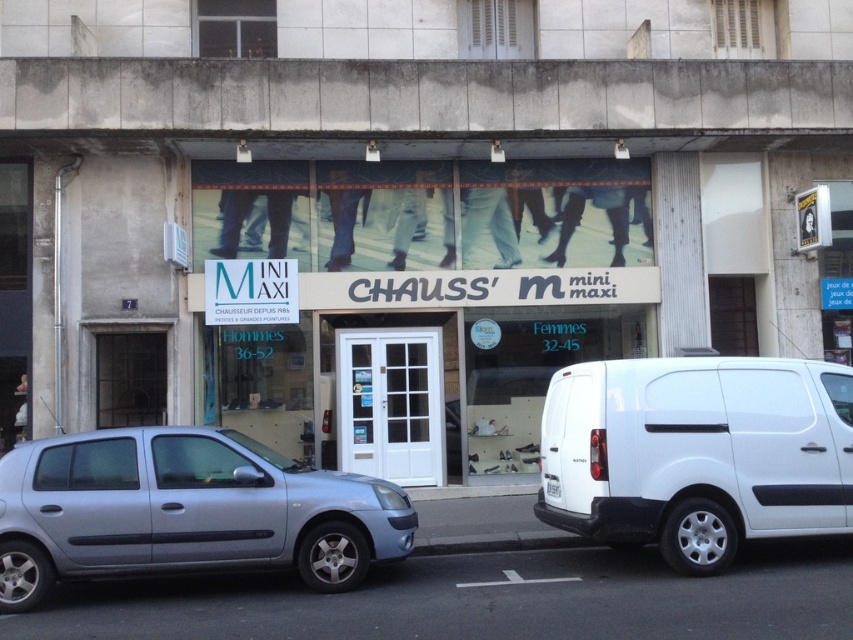
Question: Which of the following is the closest to the observer?

Choices:
 (A) (787, 420)
 (B) (67, 572)

Answer: (B)

Question: From the image, what is the correct spatial relationship of white matte van at right in relation to satin silver car at lower left?

Choices:
 (A) left
 (B) right

Answer: (B)

Question: Is white matte van at right below satin silver car at lower left?

Choices:
 (A) no
 (B) yes

Answer: (A)

Question: Which point is farther to the camera?

Choices:
 (A) white matte van at right
 (B) satin silver car at lower left

Answer: (A)

Question: Among these points, which one is nearest to the camera?

Choices:
 (A) (97, 432)
 (B) (602, 534)

Answer: (B)

Question: Is white matte van at right above satin silver car at lower left?

Choices:
 (A) yes
 (B) no

Answer: (A)